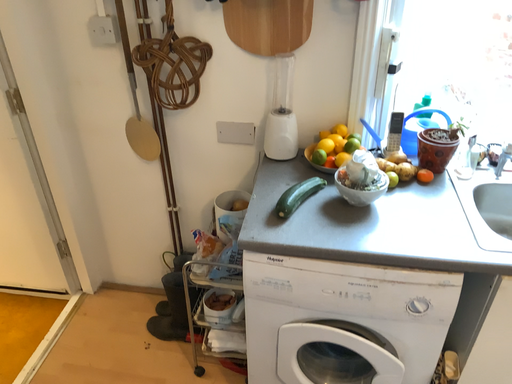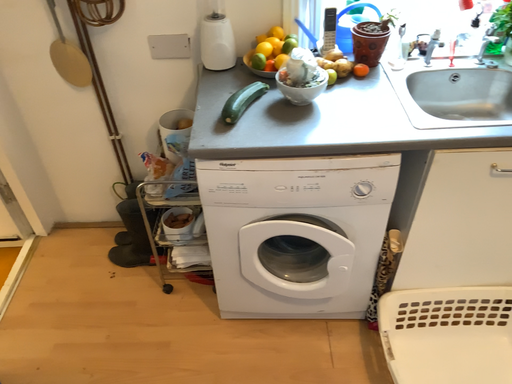
Question: How did the camera likely rotate when shooting the video?

Choices:
 (A) rotated upward
 (B) rotated downward

Answer: (B)